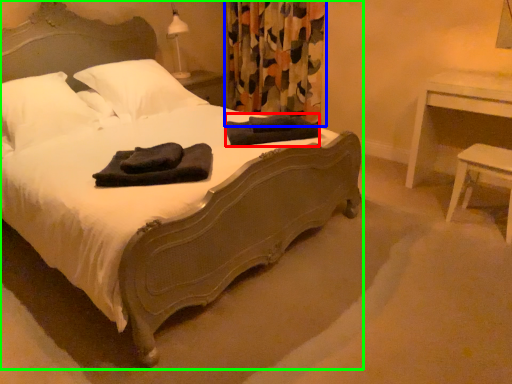
Question: Estimate the real-world distances between objects in this image. Which object is closer to material (highlighted by a red box), curtain (highlighted by a blue box) or bed (highlighted by a green box)?

Choices:
 (A) curtain
 (B) bed

Answer: (B)